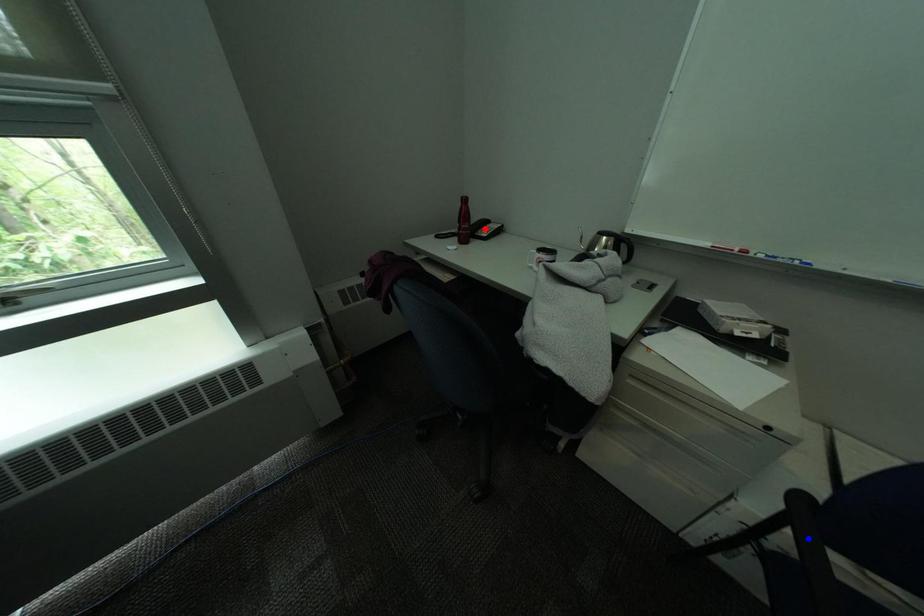
Question: Two points are marked on the image. Which point is closer to the camera?

Choices:
 (A) Blue point is closer.
 (B) Red point is closer.

Answer: (A)